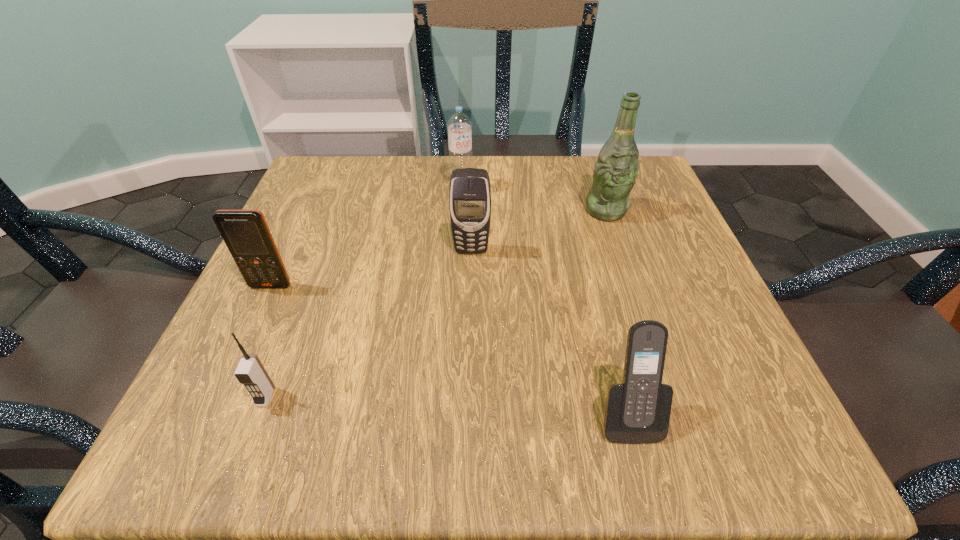
The width and height of the screenshot is (960, 540). I want to click on free location located 0.160m on the surface of the tallest object, so click(x=629, y=280).

Identify the location of free space located 0.310m on the front of the farthest object. (456, 301).

I want to click on free space located on the front face of the farthest cellular telephone, so click(x=468, y=404).

Identify the location of vacant region located 0.180m on the screen of the fourth farthest object. This screenshot has width=960, height=540. (226, 383).

You are a GUI agent. You are given a task and a screenshot of the screen. Output one action in this format:
    pyautogui.click(x=<x>, y=<y>)
    Task: Click on the free space located 0.060m on the front-facing side of the third cellular telephone from right to left
    This screenshot has height=540, width=960.
    Given the screenshot: What is the action you would take?
    pyautogui.click(x=245, y=451)

The height and width of the screenshot is (540, 960). What are the coordinates of `beer bottle that is at the far edge` in the screenshot? It's located at (615, 172).

Locate an element on the screen. water bottle present at the far edge is located at coordinates (459, 125).

Identify the location of beer bottle that is at the right edge. (615, 172).

Where is `cellular telephone at the right edge`? The image size is (960, 540). cellular telephone at the right edge is located at coordinates (637, 411).

You are a GUI agent. You are given a task and a screenshot of the screen. Output one action in this format:
    pyautogui.click(x=<x>, y=<y>)
    Task: Click on the object located in the near left corner section of the desktop
    Image resolution: width=960 pixels, height=540 pixels.
    Given the screenshot: What is the action you would take?
    pyautogui.click(x=250, y=372)